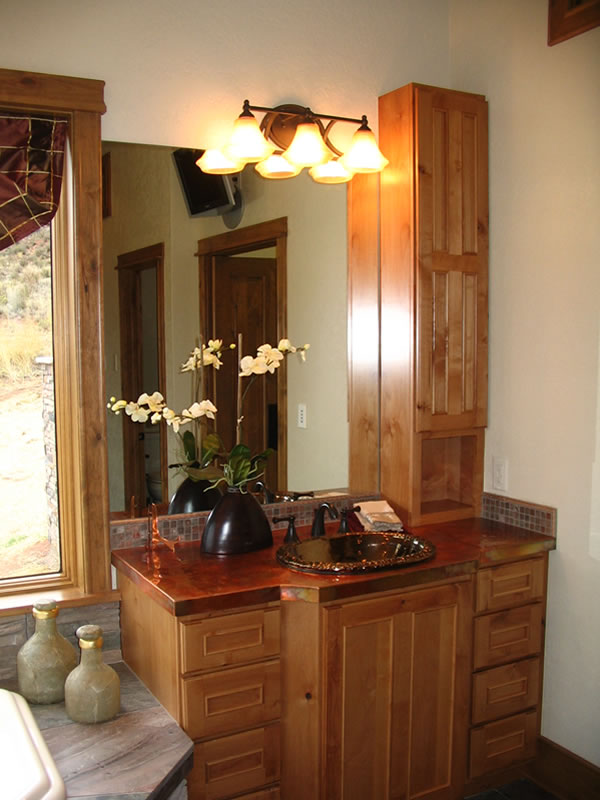
Identify the location of sink. (347, 550).